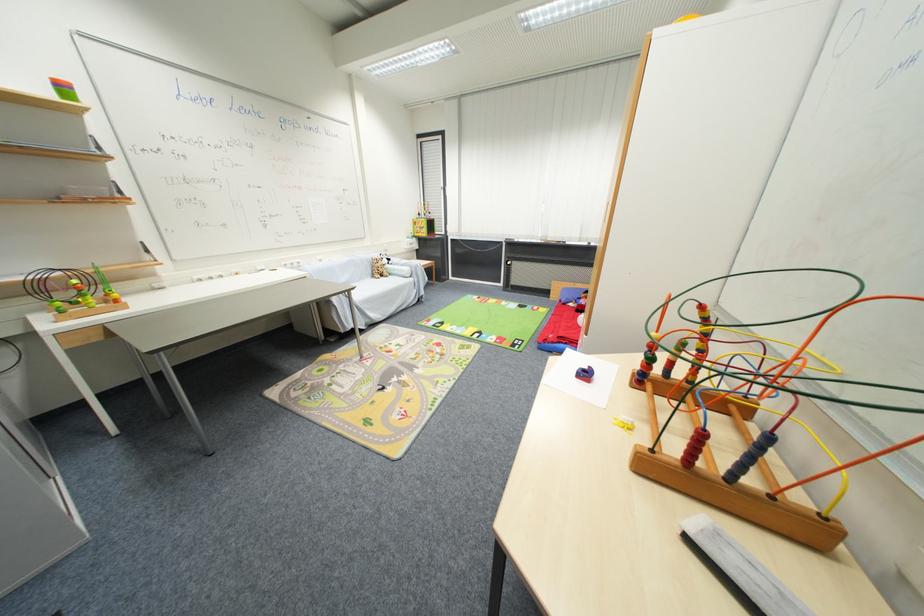
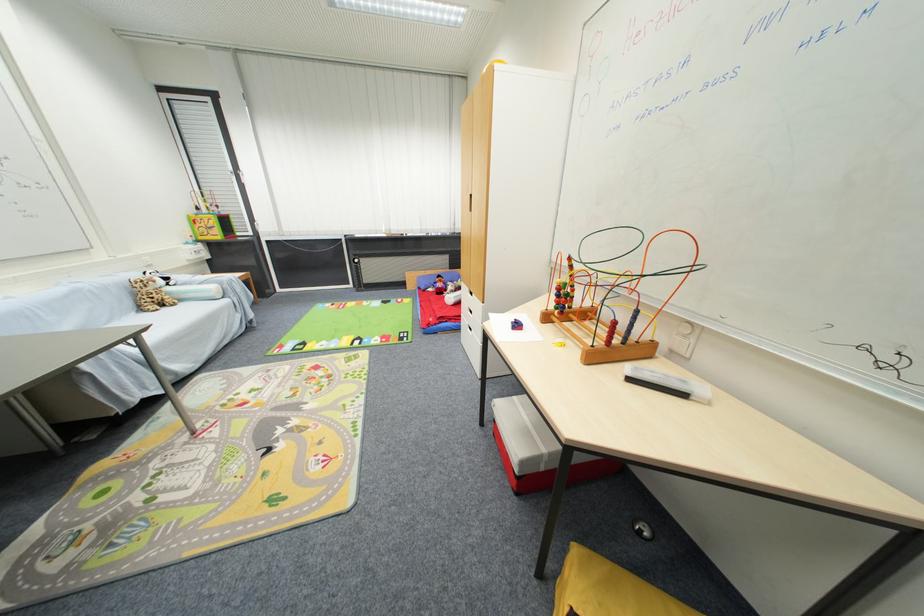
Find the pixel in the second image that matches (x=429, y=236) in the first image.

(223, 238)